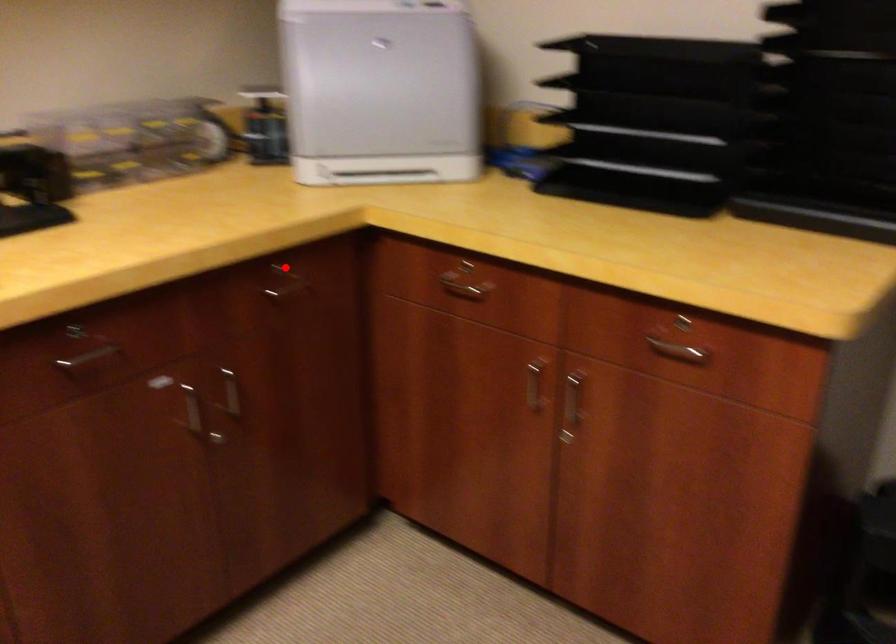
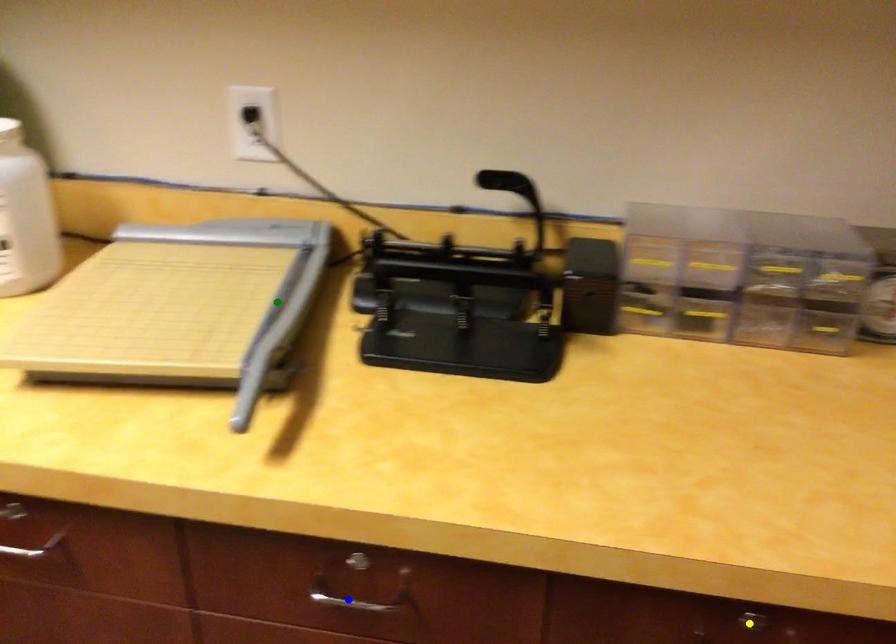
Question: I am providing you with two images of the same scene from different viewpoints. A red point is marked on the first image. You are given multiple points on the second image. Can you choose the point in image 2 that corresponds to the point in image 1?

Choices:
 (A) yellow point
 (B) green point
 (C) blue point

Answer: (A)